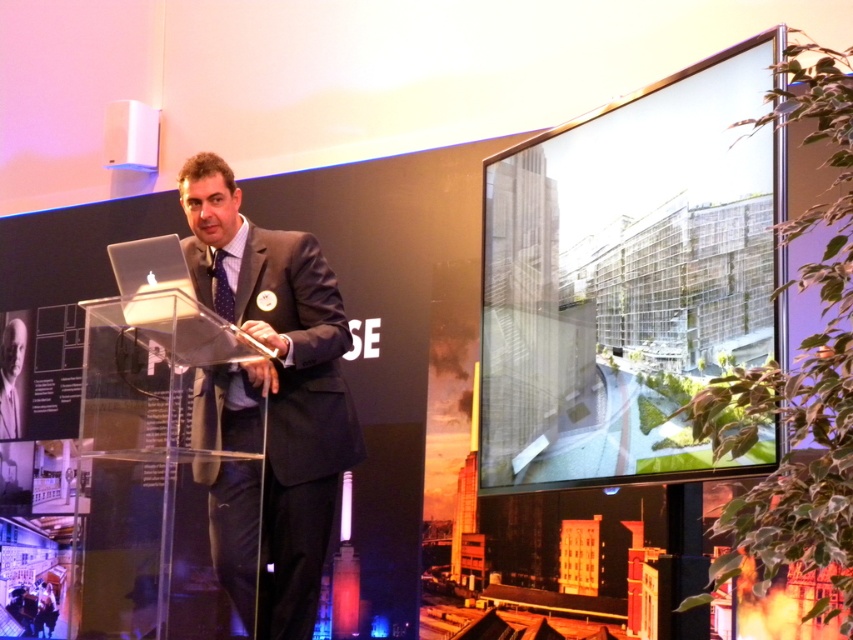
Question: Is the position of transparent glass screen at upper right less distant than that of blue dotted fabric tie at center?

Choices:
 (A) yes
 (B) no

Answer: (A)

Question: Does transparent glass screen at upper right appear on the right side of dark gray suit at center?

Choices:
 (A) no
 (B) yes

Answer: (B)

Question: Among these objects, which one is farthest from the camera?

Choices:
 (A) transparent glass screen at upper right
 (B) blue dotted fabric tie at center
 (C) dark gray suit at center

Answer: (B)

Question: Based on their relative distances, which object is farther from the transparent glass screen at upper right?

Choices:
 (A) dark gray suit at center
 (B) blue dotted fabric tie at center

Answer: (B)

Question: From the image, what is the correct spatial relationship of dark gray suit at center in relation to blue dotted fabric tie at center?

Choices:
 (A) left
 (B) right

Answer: (B)

Question: Estimate the real-world distances between objects in this image. Which object is closer to the transparent glass screen at upper right?

Choices:
 (A) dark gray suit at center
 (B) blue dotted fabric tie at center

Answer: (A)